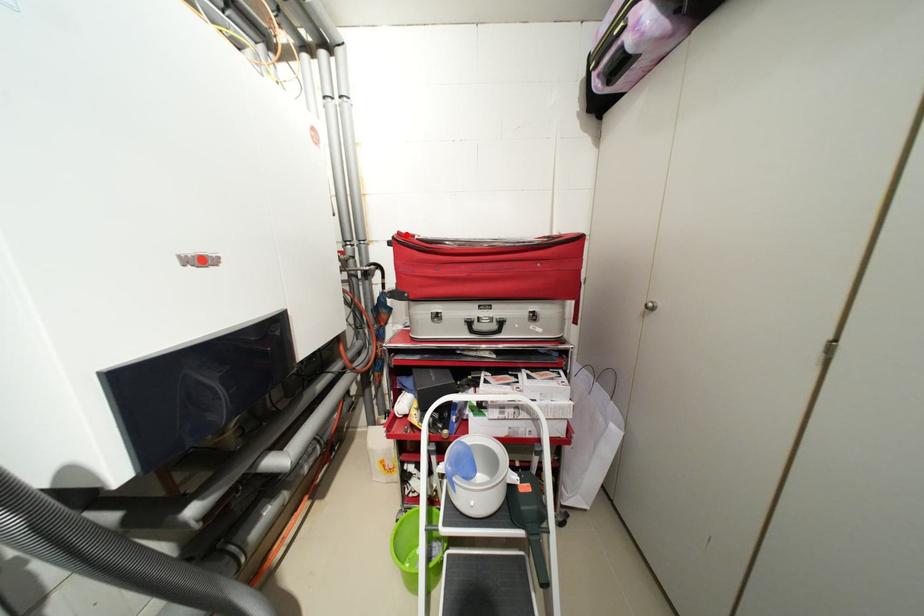
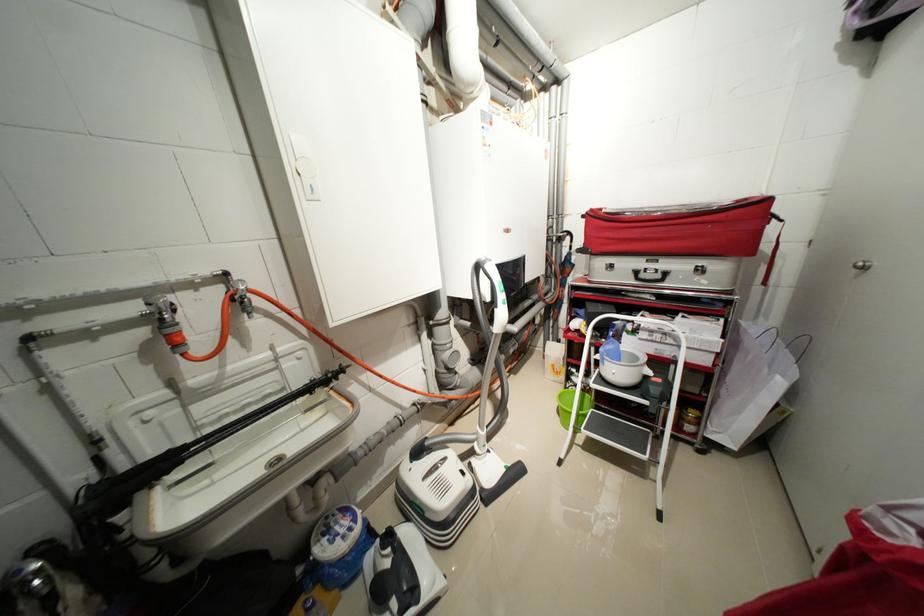
Locate, in the second image, the point that corresponds to the highlighted location in the first image.

(599, 211)